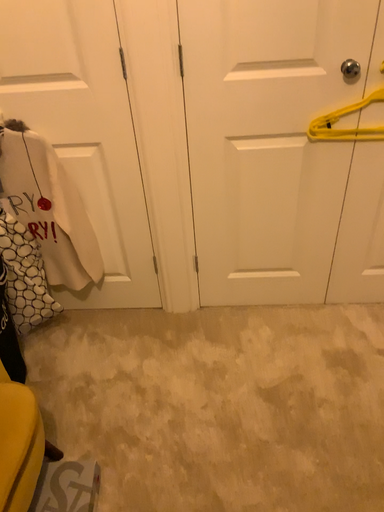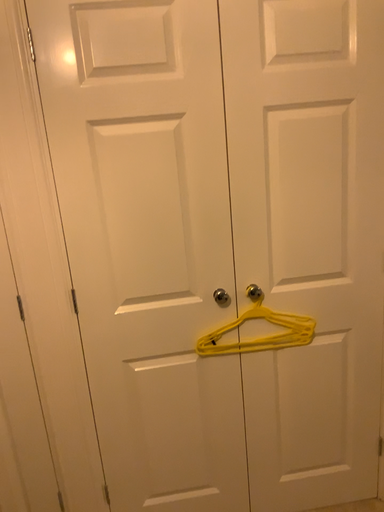
Question: Which way did the camera rotate in the video?

Choices:
 (A) rotated right
 (B) rotated left

Answer: (A)